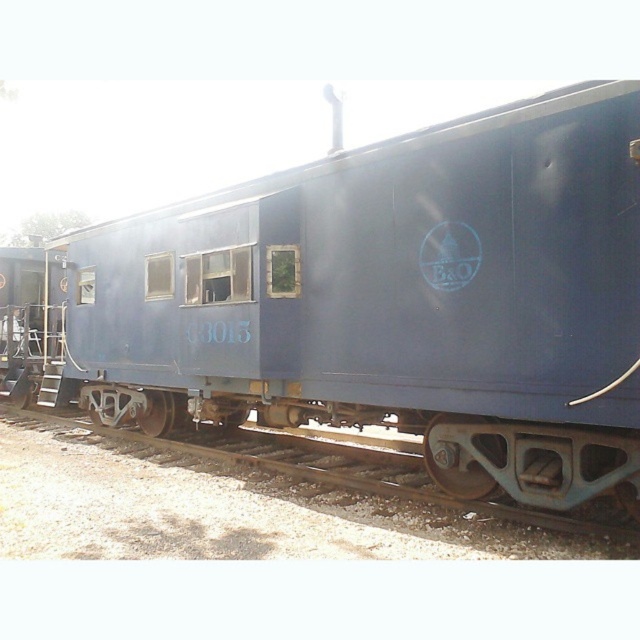
Does blue matte train car at center appear on the right side of rusty metal track at lower center?

Incorrect, blue matte train car at center is not on the right side of rusty metal track at lower center.

Find the location of a particular element. This screenshot has width=640, height=640. blue matte train car at center is located at coordinates (376, 300).

You are a GUI agent. You are given a task and a screenshot of the screen. Output one action in this format:
    pyautogui.click(x=<x>, y=<y>)
    Task: Click on the blue matte train car at center
    The width and height of the screenshot is (640, 640).
    Given the screenshot: What is the action you would take?
    pyautogui.click(x=376, y=300)